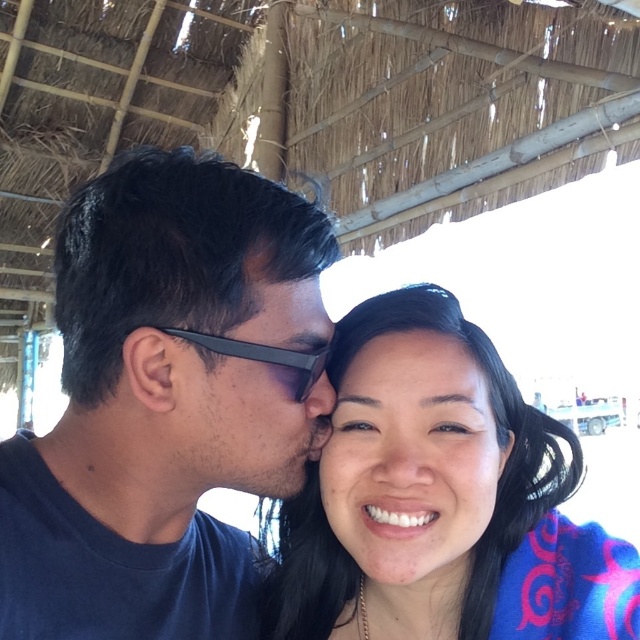
Question: Is smooth skin face at center thinner than black matte goggles at left?

Choices:
 (A) no
 (B) yes

Answer: (A)

Question: Which of the following is the farthest from the observer?

Choices:
 (A) coord(321,352)
 (B) coord(337,394)
 (C) coord(204,440)

Answer: (B)

Question: Is dark blue shirt at left behind matte black sunglasses at center?

Choices:
 (A) yes
 (B) no

Answer: (B)

Question: Which of the following is the farthest from the observer?

Choices:
 (A) smooth skin face at center
 (B) black matte goggles at left
 (C) matte black sunglasses at center
 (D) smooth skin at center

Answer: (D)

Question: Among these points, which one is nearest to the camera?

Choices:
 (A) (314, 596)
 (B) (406, 365)
 (C) (248, 600)
 (D) (285, 358)

Answer: (D)

Question: Does smooth skin face at center appear on the right side of smooth skin at center?

Choices:
 (A) yes
 (B) no

Answer: (A)